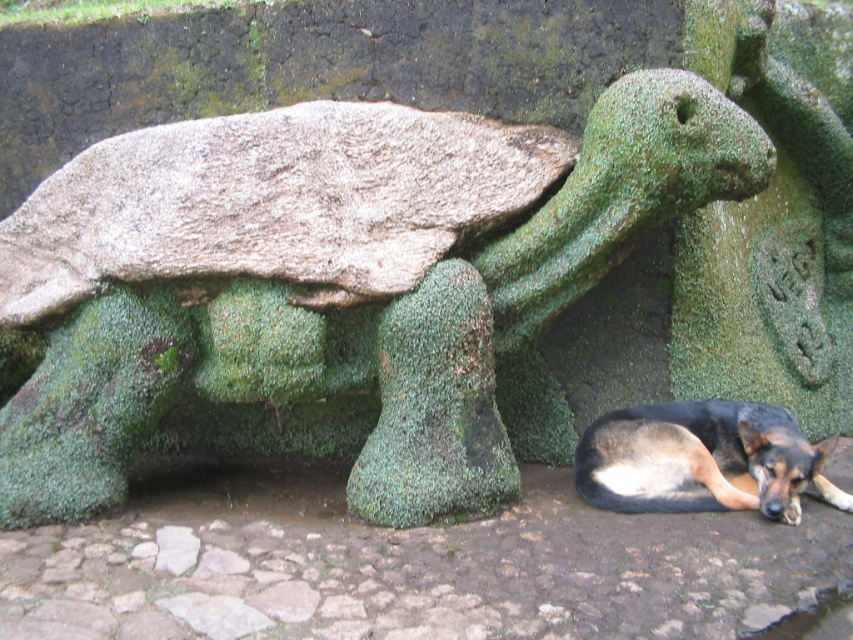
Question: Which point is farther to the camera?

Choices:
 (A) green mossy turtle at center
 (B) black and tan fur dog at lower right

Answer: (A)

Question: Is green mossy turtle at center behind black and tan fur dog at lower right?

Choices:
 (A) yes
 (B) no

Answer: (A)

Question: Is green mossy turtle at center further to the viewer compared to black and tan fur dog at lower right?

Choices:
 (A) no
 (B) yes

Answer: (B)

Question: Observing the image, what is the correct spatial positioning of green mossy turtle at center in reference to black and tan fur dog at lower right?

Choices:
 (A) right
 (B) left

Answer: (B)